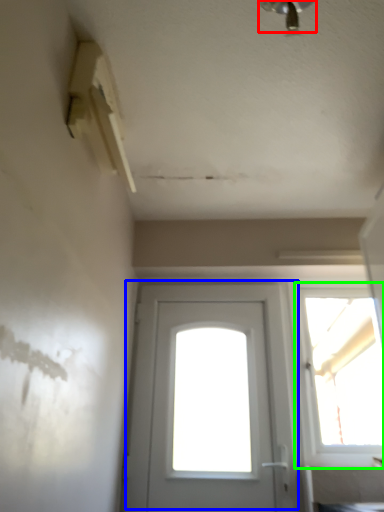
Question: Estimate the real-world distances between objects in this image. Which object is closer to light fixture (highlighted by a red box), door (highlighted by a blue box) or window (highlighted by a green box)?

Choices:
 (A) door
 (B) window

Answer: (B)